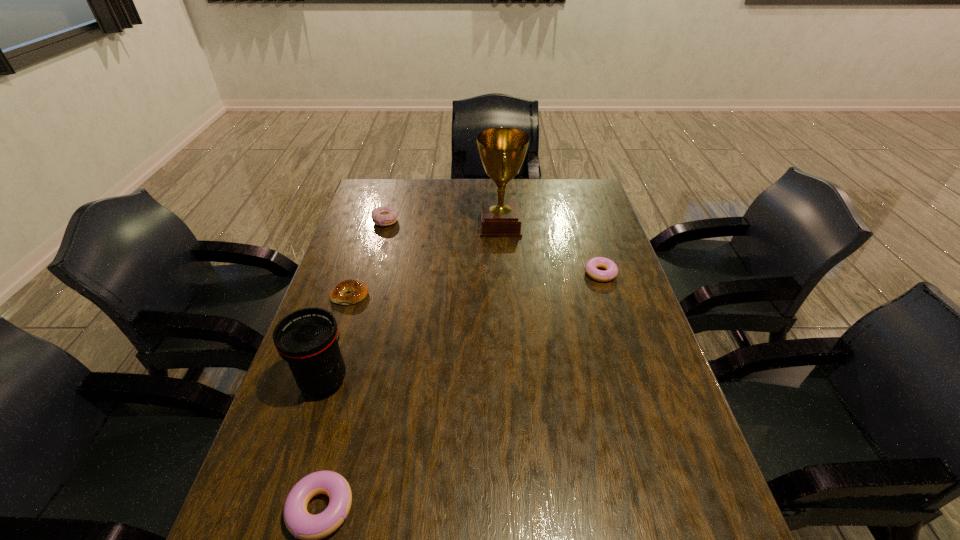
What are the coordinates of `object that is the fifth closest to the third nearest object` in the screenshot? It's located at (610, 273).

This screenshot has height=540, width=960. I want to click on the closest doughnut relative to the farthest doughnut, so click(610, 273).

Select which doughnut is the closest to the farthest doughnut. Please provide its 2D coordinates. Your answer should be formatted as a tuple, i.e. [(x, y)], where the tuple contains the x and y coordinates of a point satisfying the conditions above.

[(610, 273)]

Identify the location of free point that satisfies the following two spatial constraints: 1. on the back side of the second tallest object; 2. on the right side of the farthest doughnut. (374, 222).

The image size is (960, 540). In order to click on vacant space that satisfies the following two spatial constraints: 1. on the plaque of the shortest doughnut; 2. on the left side of the tallest object in this screenshot , I will do `click(503, 273)`.